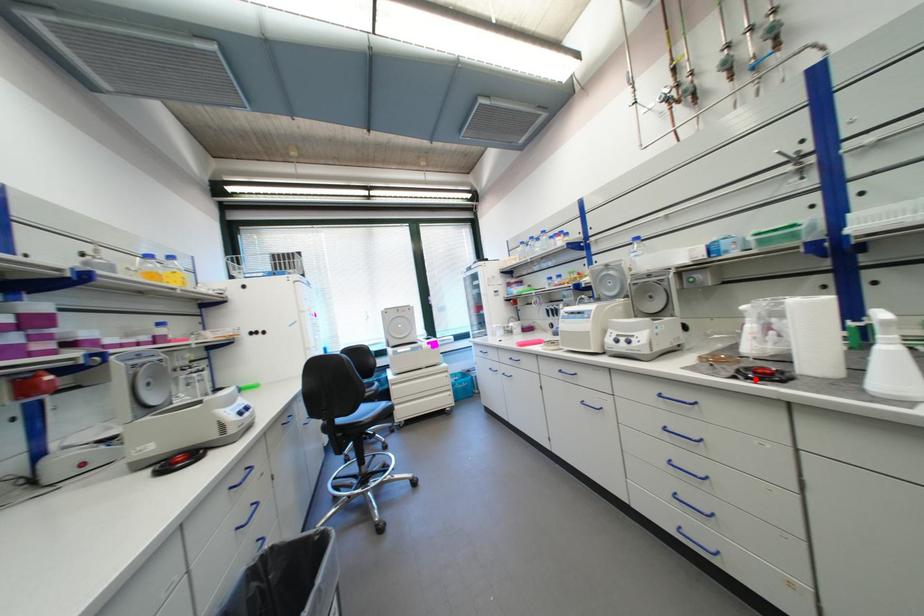
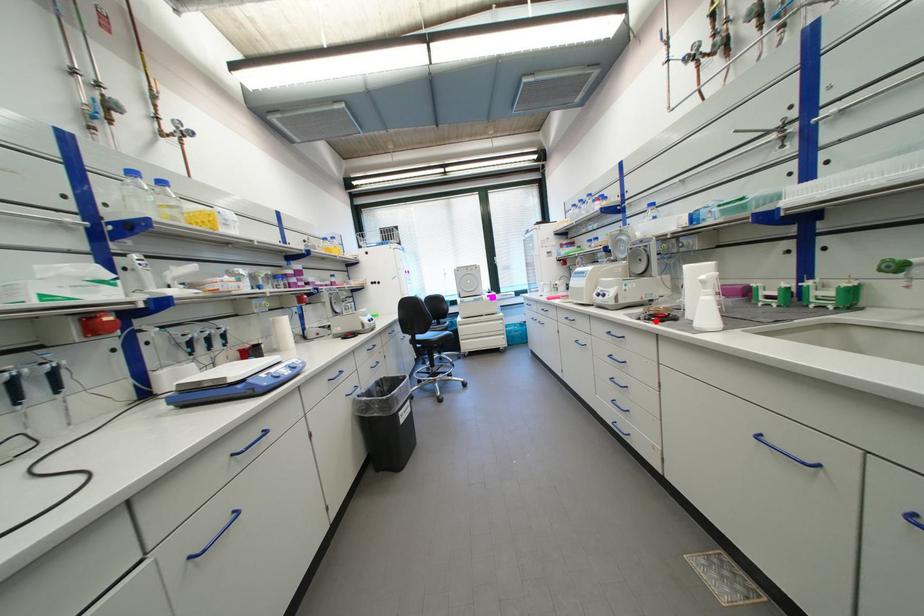
I am providing you with two images of the same scene from different viewpoints. A red point is marked on the first image and another point is marked on the second image. Is the red point in image1 aligned with the point shown in image2?

Yes